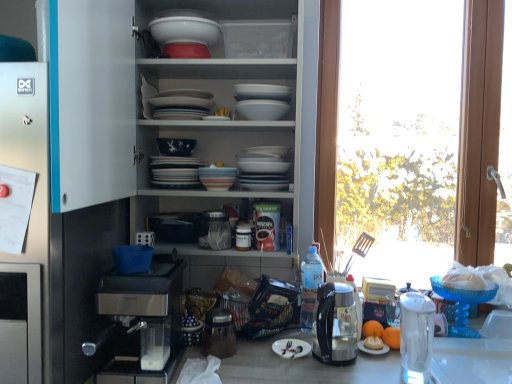
Question: From the image's perspective, is clear plastic bottle at center on pastel striped bowl at center, the third tableware from the right?

Choices:
 (A) yes
 (B) no

Answer: (B)

Question: Can we say clear plastic bottle at center lies outside pastel striped bowl at center, the third tableware from the right?

Choices:
 (A) no
 (B) yes

Answer: (B)

Question: From a real-world perspective, is clear plastic bottle at center on pastel striped bowl at center, which is the 1th tableware in left-to-right order?

Choices:
 (A) no
 (B) yes

Answer: (A)

Question: Does clear plastic bottle at center have a larger size compared to pastel striped bowl at center, which is the 1th tableware in left-to-right order?

Choices:
 (A) no
 (B) yes

Answer: (B)

Question: Is clear plastic bottle at center surrounding pastel striped bowl at center, which is the 1th tableware in left-to-right order?

Choices:
 (A) yes
 (B) no

Answer: (B)

Question: In terms of width, does translucent glass orange juice at lower right look wider or thinner when compared to metallic silver canister at center, the 1th appliance positioned from the bottom?

Choices:
 (A) thin
 (B) wide

Answer: (A)

Question: Considering the positions of point (376, 331) and point (224, 347), is point (376, 331) closer or farther from the camera than point (224, 347)?

Choices:
 (A) closer
 (B) farther

Answer: (B)

Question: From the image's perspective, is translucent glass orange juice at lower right located above or below metallic silver canister at center, the 4th appliance when ordered from top to bottom?

Choices:
 (A) below
 (B) above

Answer: (A)

Question: From a real-world perspective, is translucent glass orange juice at lower right physically located above or below metallic silver canister at center, positioned as the third appliance in left-to-right order?

Choices:
 (A) below
 (B) above

Answer: (A)

Question: Is silver plated fork at center taller or shorter than transparent glass jar at center, positioned as the 3th appliance in bottom-to-top order?

Choices:
 (A) short
 (B) tall

Answer: (A)

Question: From the image's perspective, is silver plated fork at center located above or below transparent glass jar at center, positioned as the 3th appliance in bottom-to-top order?

Choices:
 (A) above
 (B) below

Answer: (B)

Question: Based on their sizes in the image, would you say silver plated fork at center is bigger or smaller than transparent glass jar at center, the third appliance when ordered from right to left?

Choices:
 (A) small
 (B) big

Answer: (A)

Question: Is point (290, 345) positioned closer to the camera than point (228, 233)?

Choices:
 (A) farther
 (B) closer

Answer: (B)

Question: From the image's perspective, is white glossy bowl at upper center, which is the 1th appliance in left-to-right order, above or below transparent glass window at right?

Choices:
 (A) below
 (B) above

Answer: (B)

Question: Is white glossy bowl at upper center, the fourth appliance positioned from the bottom, wider or thinner than transparent glass window at right?

Choices:
 (A) wide
 (B) thin

Answer: (A)